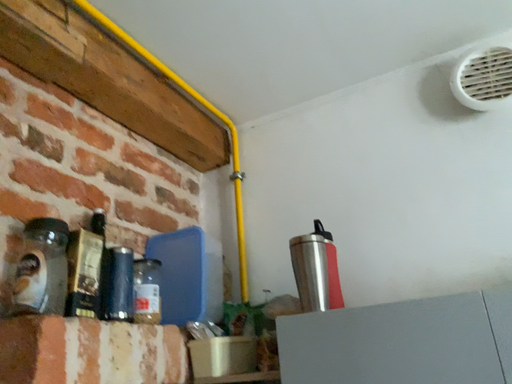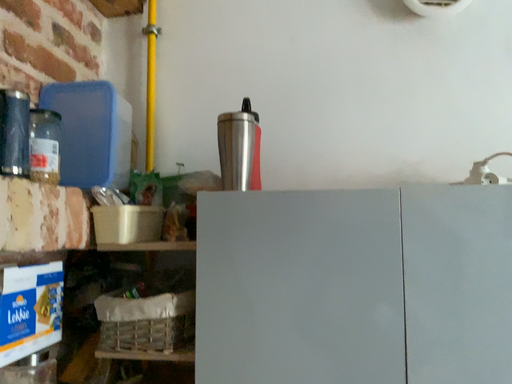
Question: How did the camera likely rotate when shooting the video?

Choices:
 (A) rotated right
 (B) rotated left

Answer: (A)